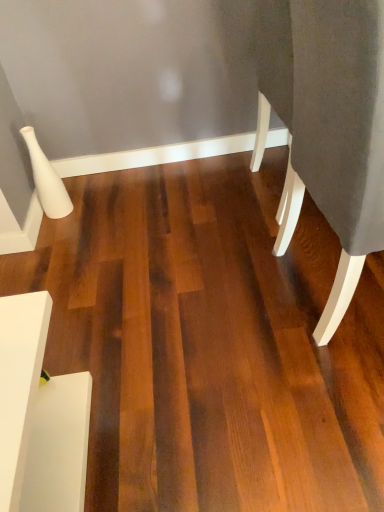
This screenshot has width=384, height=512. In order to click on free space to the right of white matte side table at lower left, the second furniture positioned from the top in this screenshot , I will do `click(158, 426)`.